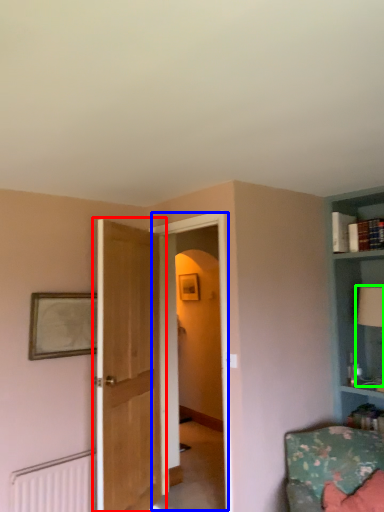
Question: Based on their relative distances, which object is farther from door (highlighted by a red box)? Choose from glass door (highlighted by a blue box) and table lamp (highlighted by a green box).

Choices:
 (A) glass door
 (B) table lamp

Answer: (B)